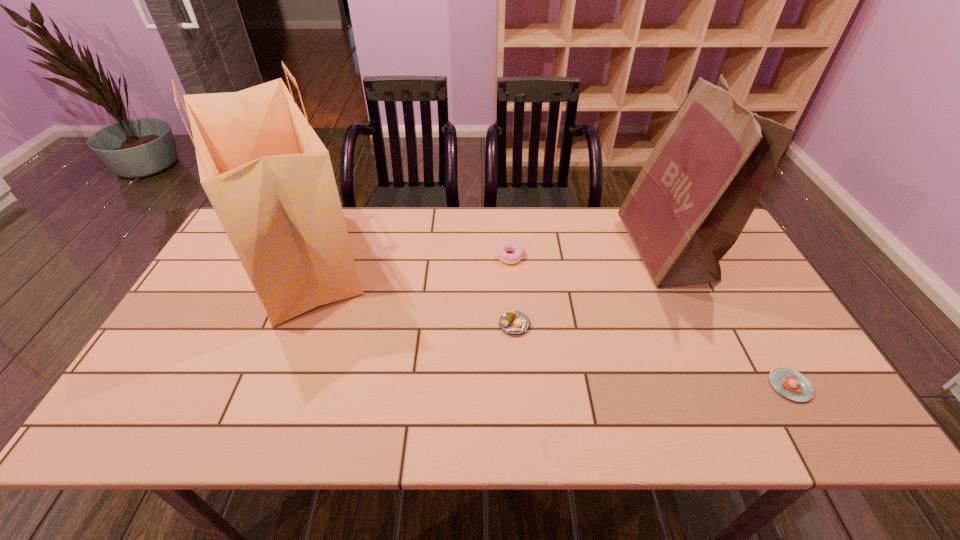
The height and width of the screenshot is (540, 960). In order to click on free space between the right grocery bag and the leftmost object in this screenshot , I will do `click(482, 255)`.

This screenshot has width=960, height=540. I want to click on free space between the farthest pastry and the nearest object, so click(650, 321).

Find the location of a particular element. This screenshot has height=540, width=960. empty space that is in between the second nearest pastry and the nearest pastry is located at coordinates (652, 355).

In order to click on vacant space that is in between the farthest pastry and the second farthest pastry in this screenshot , I will do `click(513, 291)`.

You are a GUI agent. You are given a task and a screenshot of the screen. Output one action in this format:
    pyautogui.click(x=<x>, y=<y>)
    Task: Click on the blank region between the right grocery bag and the leftmost object
    The image size is (960, 540).
    Given the screenshot: What is the action you would take?
    pyautogui.click(x=482, y=255)

Find the location of a particular element. This screenshot has height=540, width=960. empty space between the farthest pastry and the right grocery bag is located at coordinates [x=588, y=253].

Image resolution: width=960 pixels, height=540 pixels. I want to click on object that is the fourth nearest to the left grocery bag, so click(790, 383).

At what (x,y) coordinates should I click in order to perform the action: click on the closest object relative to the second farthest pastry. Please return your answer as a coordinate pair (x, y). This screenshot has width=960, height=540. Looking at the image, I should click on (518, 249).

You are a GUI agent. You are given a task and a screenshot of the screen. Output one action in this format:
    pyautogui.click(x=<x>, y=<y>)
    Task: Click on the pastry that stands as the second closest to the right grocery bag
    Image resolution: width=960 pixels, height=540 pixels.
    Given the screenshot: What is the action you would take?
    pyautogui.click(x=518, y=249)

Where is `pastry that is the nearest to the right grocery bag`? pastry that is the nearest to the right grocery bag is located at coordinates (790, 383).